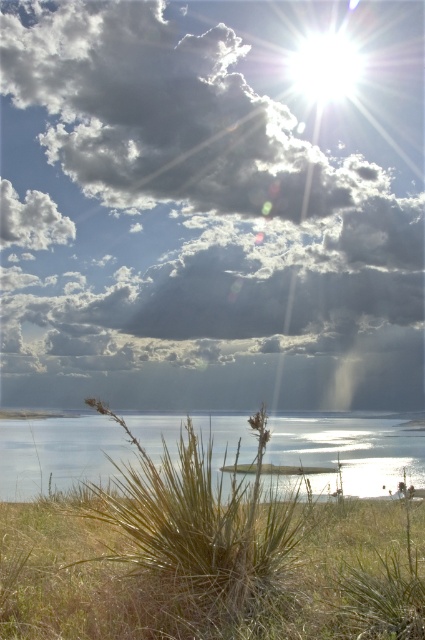
Can you confirm if cloudy sky at upper center is positioned to the right of green grass at lower left?

Yes, cloudy sky at upper center is to the right of green grass at lower left.

Does cloudy sky at upper center lie in front of green grass at lower left?

No, it is behind green grass at lower left.

Who is more forward, (84, 154) or (217, 616)?

Point (217, 616)

Locate an element on the screen. Image resolution: width=425 pixels, height=640 pixels. cloudy sky at upper center is located at coordinates (209, 205).

Is green textured grass at lower center to the right of clear water at lower center from the viewer's perspective?

In fact, green textured grass at lower center is to the left of clear water at lower center.

This screenshot has height=640, width=425. Identify the location of green textured grass at lower center. (201, 586).

Can you confirm if cloudy sky at upper center is positioned above green textured grass at lower center?

Yes, cloudy sky at upper center is above green textured grass at lower center.

Between cloudy sky at upper center and green textured grass at lower center, which one appears on the left side from the viewer's perspective?

green textured grass at lower center

Between point (226, 264) and point (291, 634), which one is positioned behind?

The point (226, 264) is behind.

At what (x,y) coordinates should I click in order to perform the action: click on cloudy sky at upper center. Please return your answer as a coordinate pair (x, y). Looking at the image, I should click on (209, 205).